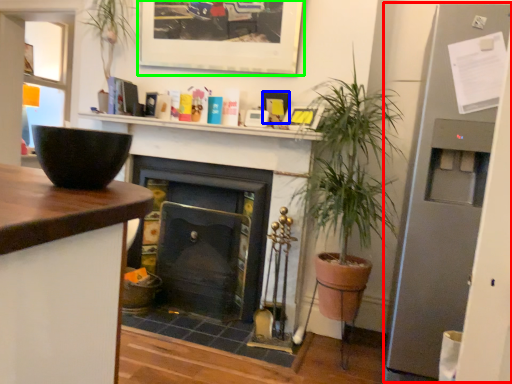
Question: Considering the real-world distances, which object is farthest from fridge (highlighted by a red box)? picture frame (highlighted by a blue box) or picture frame (highlighted by a green box)?

Choices:
 (A) picture frame
 (B) picture frame

Answer: (B)